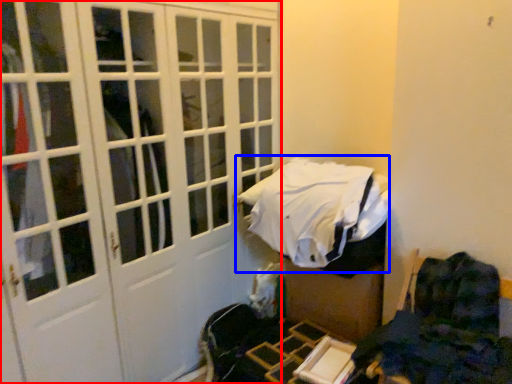
Question: Among these objects, which one is farthest to the camera, door (highlighted by a red box) or bed (highlighted by a blue box)?

Choices:
 (A) door
 (B) bed

Answer: (B)